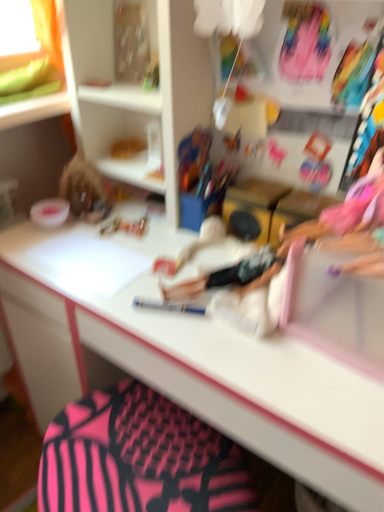
You are a GUI agent. You are given a task and a screenshot of the screen. Output one action in this format:
    pyautogui.click(x=<x>, y=<y>)
    Task: Click on the free space above pink fabric swivel chair at lower center (from a real-world perspective)
    Image resolution: width=384 pixels, height=512 pixels.
    Given the screenshot: What is the action you would take?
    pyautogui.click(x=123, y=448)